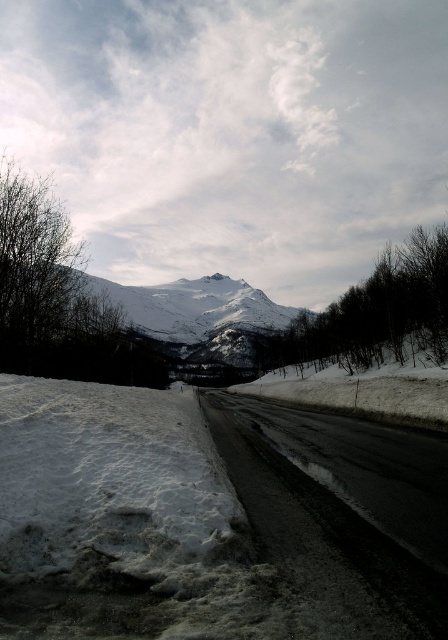
Between white fluffy snow at lower left and snowy rocky mountain at center, which one has more height?

snowy rocky mountain at center

At what (x,y) coordinates should I click in order to perform the action: click on white fluffy snow at lower left. Please return your answer as a coordinate pair (x, y). Image resolution: width=448 pixels, height=640 pixels. Looking at the image, I should click on (107, 477).

This screenshot has width=448, height=640. Find the location of `white fluffy snow at lower left`. white fluffy snow at lower left is located at coordinates (107, 477).